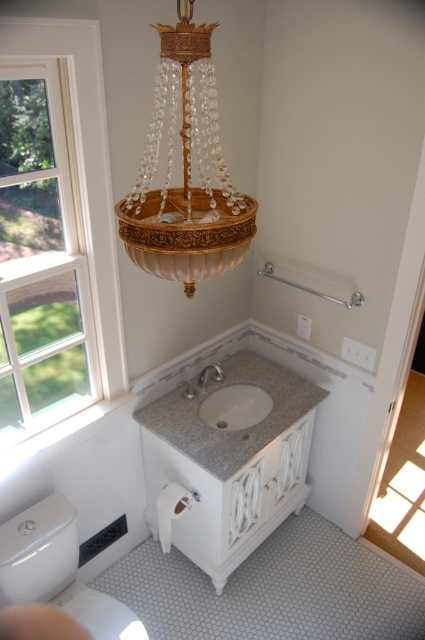
You are standing in the bathroom and want to reach a point that is behind another point. Which point should you target if you want to reach the one that is further away from you? The points are point (61, 342) and point (200, 374).

Point (200, 374) is further away from you because it is behind point (61, 342).

You are designing a bathroom layout and need to ensure that the gold crystal chandelier at upper center and the white granite sink at center will fit within a 1.2 meter wide space. Can both objects fit side by side horizontally?

The gold crystal chandelier at upper center has a width less than the white granite sink at center. If the sink is wider than the chandelier, their combined widths might exceed 1.2 meters. However, without exact measurements, it is uncertain. Please verify the exact dimensions.

You are standing in the bathroom and want to check if there is a window in the upper left corner. Can you confirm if there is a clear glass window at point (56, 236)?

Yes, the clear glass window at upper left is located at point (56, 236).